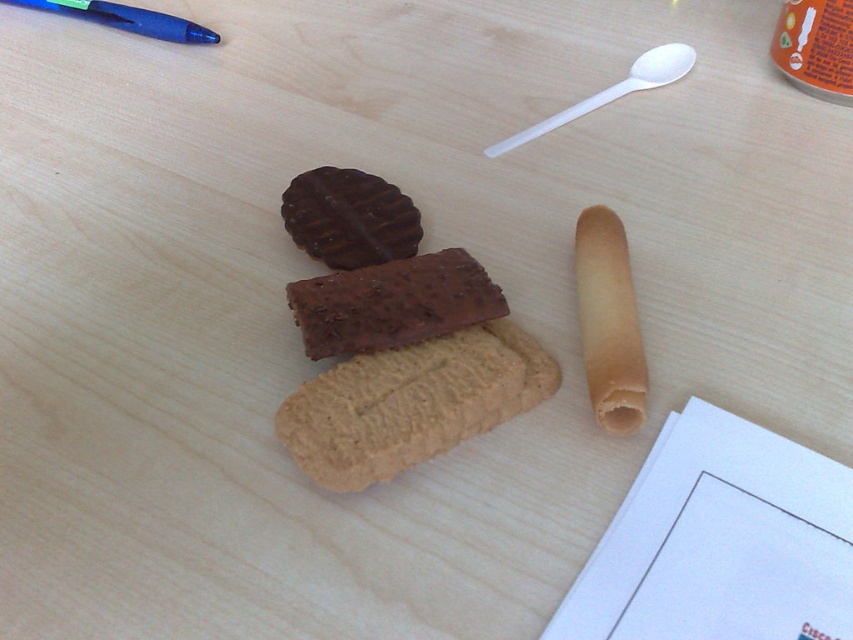
Is golden textured cookie at center to the right of chocolatesmoothbar at center from the viewer's perspective?

Correct, you'll find golden textured cookie at center to the right of chocolatesmoothbar at center.

Can you confirm if golden textured cookie at center is bigger than chocolatesmoothbar at center?

Yes, golden textured cookie at center is bigger than chocolatesmoothbar at center.

Between point (334, 417) and point (474, 278), which one is positioned behind?

Point (474, 278)

Find the location of a particular element. golden textured cookie at center is located at coordinates (410, 403).

Can you confirm if beige matte rolling pin at center-right is positioned to the right of white plastic spoon at upper center?

Incorrect, beige matte rolling pin at center-right is not on the right side of white plastic spoon at upper center.

Does beige matte rolling pin at center-right appear under white plastic spoon at upper center?

Yes.

Which is behind, point (596, 268) or point (675, 51)?

Positioned behind is point (675, 51).

Image resolution: width=853 pixels, height=640 pixels. In order to click on beige matte rolling pin at center-right in this screenshot , I will do click(608, 321).

Does chocolatesmoothbar at center have a lesser height compared to blue plastic pen at upper left?

No.

Can you confirm if chocolatesmoothbar at center is wider than blue plastic pen at upper left?

No, chocolatesmoothbar at center is not wider than blue plastic pen at upper left.

Is point (352, 294) farther from camera compared to point (91, 0)?

No, it is in front of (91, 0).

This screenshot has height=640, width=853. What are the coordinates of `chocolatesmoothbar at center` in the screenshot? It's located at (392, 304).